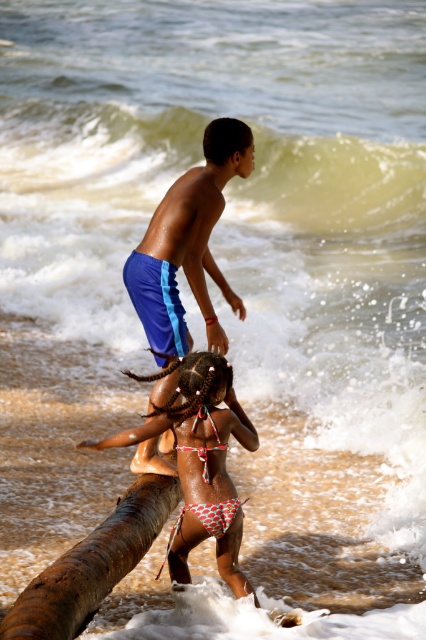
Does blue fabric shorts at upper center have a larger size compared to brown rough tree trunk at lower left?

Correct, blue fabric shorts at upper center is larger in size than brown rough tree trunk at lower left.

Who is lower down, blue fabric shorts at upper center or brown rough tree trunk at lower left?

brown rough tree trunk at lower left is below.

Is point (163, 220) closer to camera compared to point (60, 604)?

No, it is behind (60, 604).

The width and height of the screenshot is (426, 640). What are the coordinates of `blue fabric shorts at upper center` in the screenshot? It's located at (187, 244).

Is polka dot bikini at center positioned behind brown rough tree trunk at lower left?

That is True.

The image size is (426, 640). What do you see at coordinates (201, 461) in the screenshot? I see `polka dot bikini at center` at bounding box center [201, 461].

Between point (216, 516) and point (138, 509), which one is positioned in front?

Point (216, 516) is in front.

Locate an element on the screen. polka dot bikini at center is located at coordinates (201, 461).

Does blue fabric shorts at upper center lie in front of polka dot bikini at center?

No.

Who is positioned more to the left, blue fabric shorts at upper center or polka dot bikini at center?

From the viewer's perspective, polka dot bikini at center appears more on the left side.

Between point (154, 451) and point (199, 394), which one is positioned in front?

Point (199, 394)

Locate an element on the screen. blue fabric shorts at upper center is located at coordinates (187, 244).